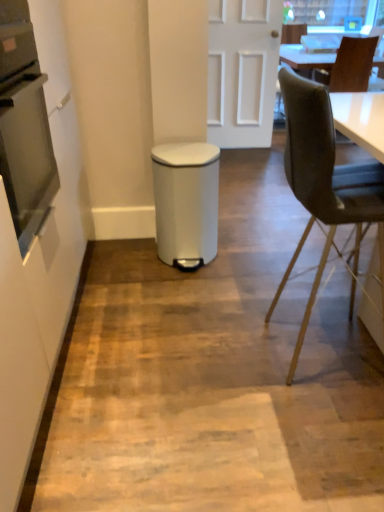
Where is `vacant space in between velvet black chair at right, acting as the 2th chair starting from the top, and white plastic waste bin at center`? The width and height of the screenshot is (384, 512). vacant space in between velvet black chair at right, acting as the 2th chair starting from the top, and white plastic waste bin at center is located at coordinates click(242, 292).